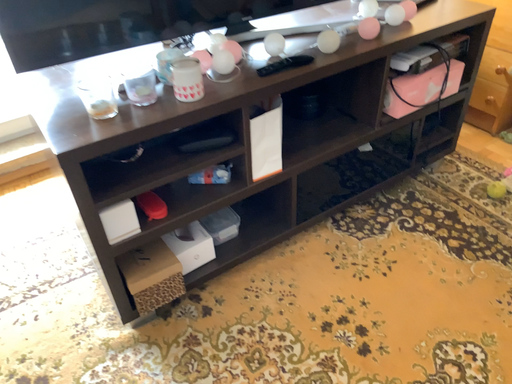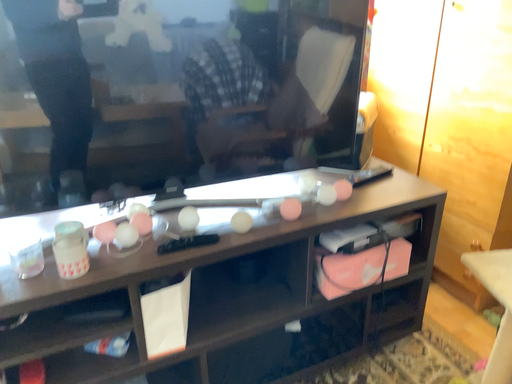
Question: Which way did the camera rotate in the video?

Choices:
 (A) rotated upward
 (B) rotated downward

Answer: (A)